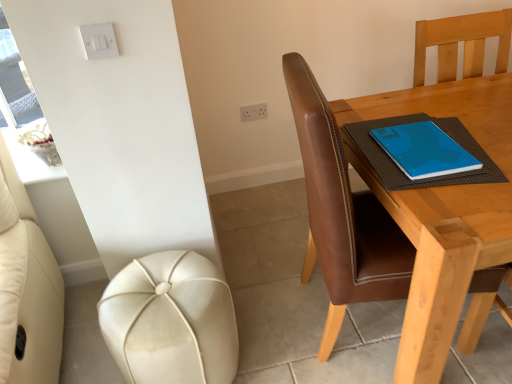
Where is `vacant location behind blue matte notebook at upper right`? Image resolution: width=512 pixels, height=384 pixels. vacant location behind blue matte notebook at upper right is located at coordinates (395, 112).